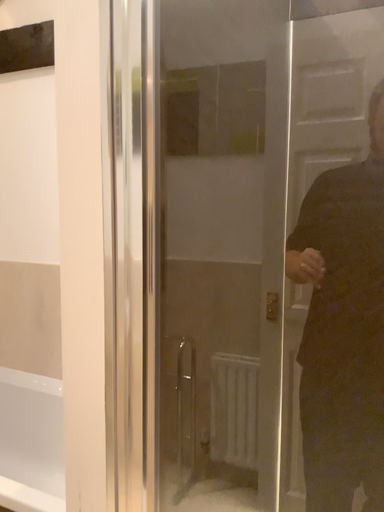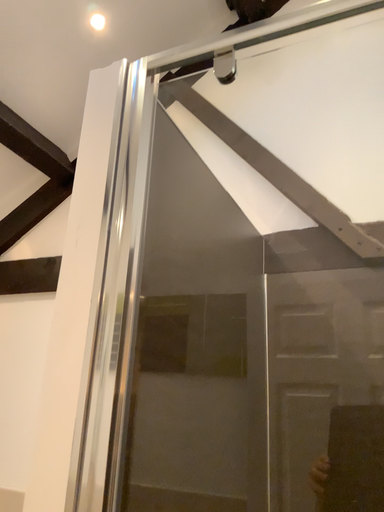
Question: How did the camera likely rotate when shooting the video?

Choices:
 (A) rotated downward
 (B) rotated upward

Answer: (B)